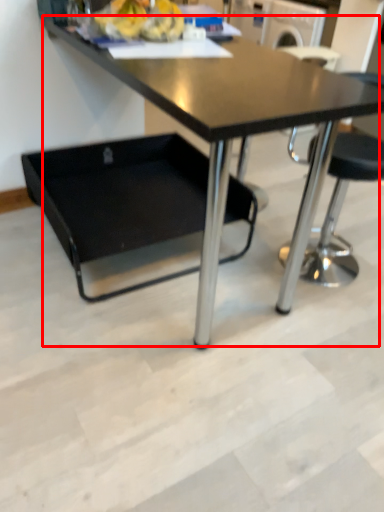
Question: Observing the image, what is the correct spatial positioning of table (annotated by the red box) in reference to swivel chair?

Choices:
 (A) right
 (B) left

Answer: (A)